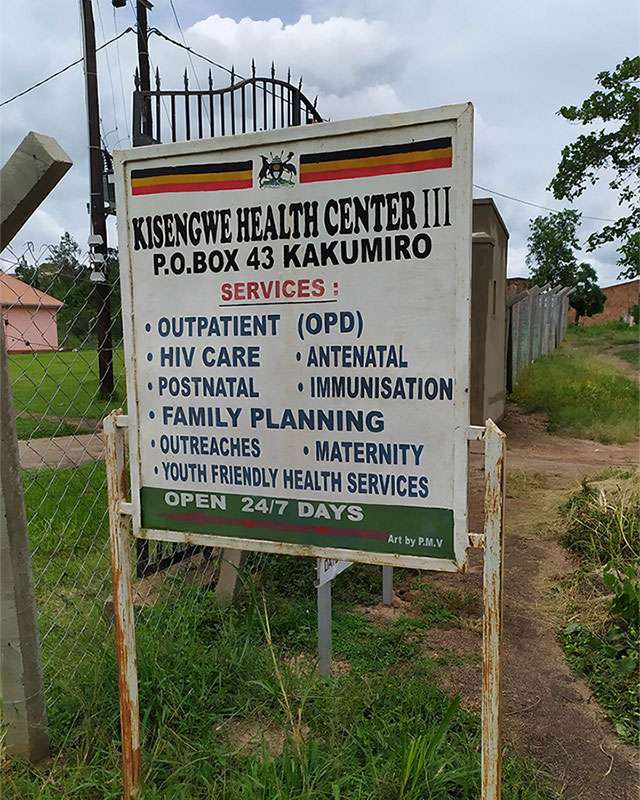
This screenshot has width=640, height=800. In order to click on wires in this screenshot , I will do `click(193, 50)`, `click(508, 198)`, `click(114, 38)`, `click(57, 70)`.